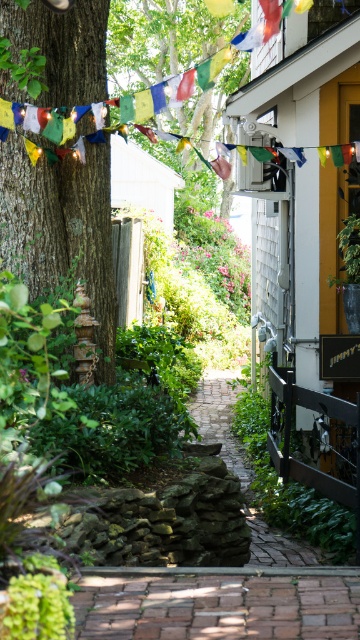
Question: Does green leafy tree at upper center appear under brick paved path at center?

Choices:
 (A) yes
 (B) no

Answer: (B)

Question: Which of the following is the closest to the observer?

Choices:
 (A) (167, 49)
 (B) (273, 545)

Answer: (B)

Question: Observing the image, what is the correct spatial positioning of green rough bark tree at left in reference to green leafy tree at upper center?

Choices:
 (A) above
 (B) below

Answer: (B)

Question: Estimate the real-world distances between objects in this image. Which object is farther from the green leafy tree at upper center?

Choices:
 (A) green rough bark tree at left
 (B) brick paved path at center

Answer: (A)

Question: Is green rough bark tree at left to the right of brick paved path at center from the viewer's perspective?

Choices:
 (A) no
 (B) yes

Answer: (A)

Question: Which point is closer to the camera?

Choices:
 (A) brick paved path at center
 (B) green rough bark tree at left

Answer: (A)